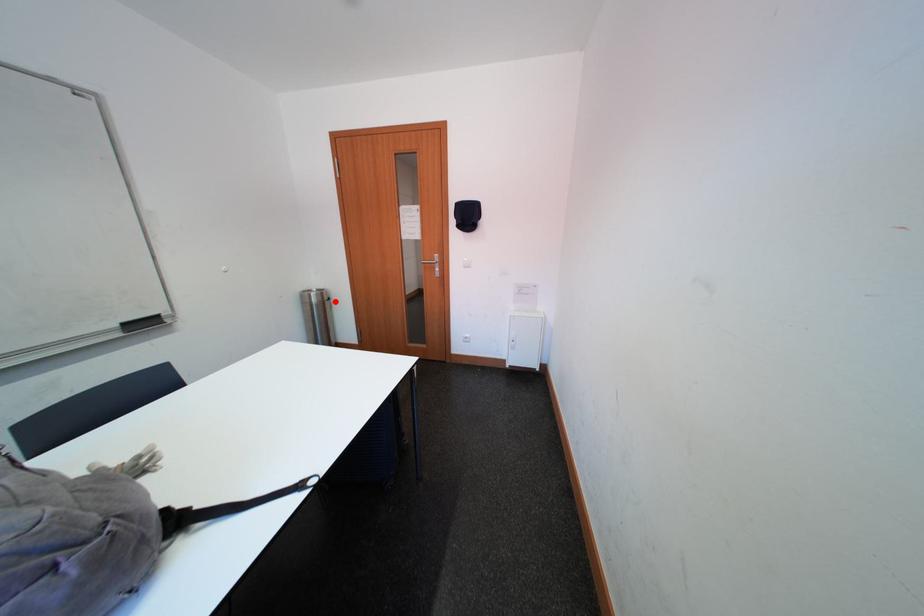
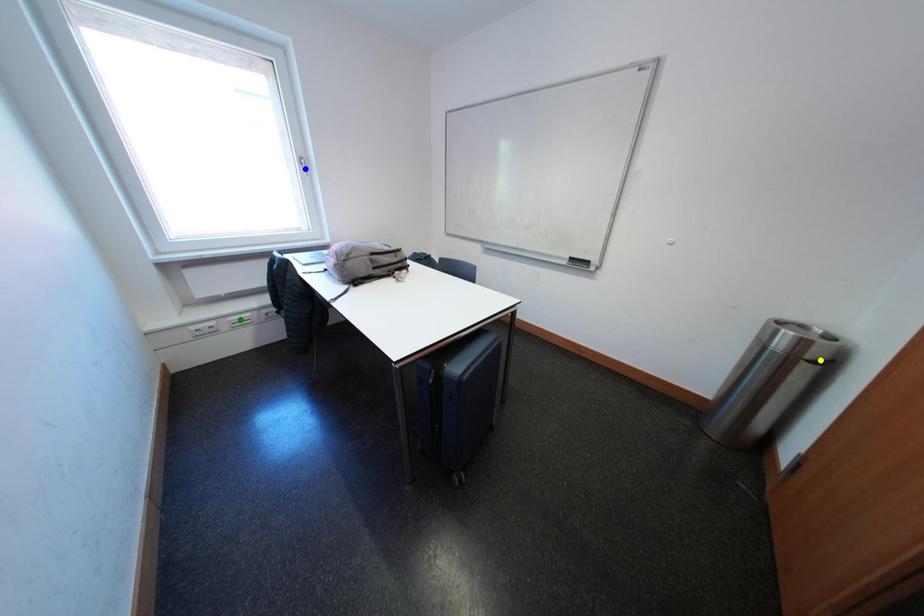
Question: I am providing you with two images of the same scene from different viewpoints. A red point is marked on the first image. You are given multiple points on the second image. In image 2, which mark is for the same physical point as the one in image 1?

Choices:
 (A) blue point
 (B) green point
 (C) yellow point

Answer: (C)